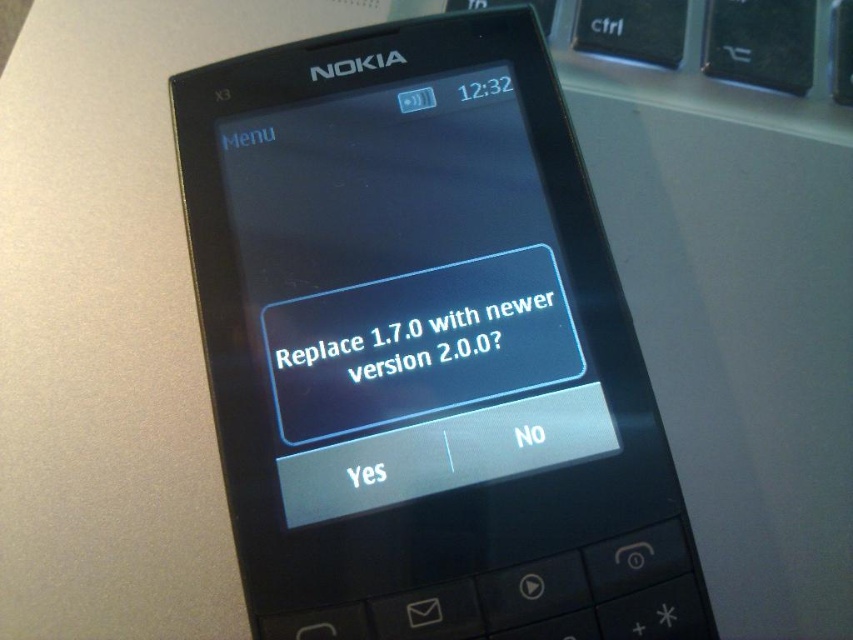
You are holding a camera and want to take a photo of the matte black screen at center. The camera requires the subject to be at least 40 inches away to avoid blurring. Based on the scene, will the current distance be sufficient?

The distance of matte black screen at center from camera is 39.02 inches, which is less than the required 40 inches. Therefore, the current distance is insufficient to avoid blurring.

You are trying to read the update prompt on the Nokia X3 smartphone. The phone has a matte black screen at center and black matte text at center. Which one is wider?

The matte black screen at center is wider than the black matte text at center.

You are taking a photo of the Nokia X3 smartphone screen. The phone is placed on a desk with its physical keyboard visible. You notice two points on the screen at coordinates point (519,321) and point (467,358). Which point will appear closer to the top of the photo?

Point (519,321) is further to the camera than point (467,358), so in the photo, point (519,321) will appear closer to the top.